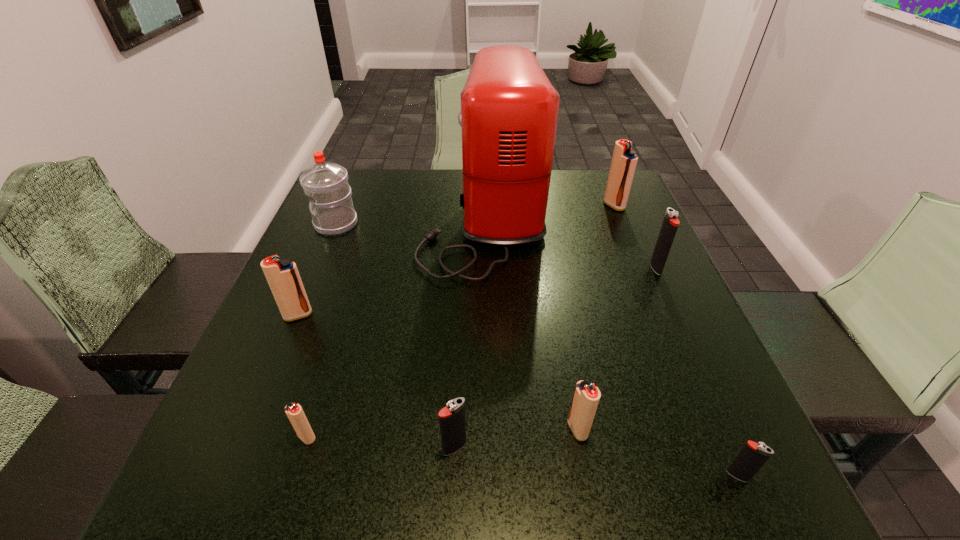
Where is `the second farthest black igniter`? This screenshot has width=960, height=540. the second farthest black igniter is located at coordinates (452, 421).

The height and width of the screenshot is (540, 960). Find the location of `the fourth igniter from right to left`. the fourth igniter from right to left is located at coordinates point(586,397).

Image resolution: width=960 pixels, height=540 pixels. In order to click on the third biggest red igniter in this screenshot , I will do `click(586, 397)`.

In order to click on the seventh object from right to left in this screenshot , I will do [294, 412].

Where is `the second igniter from left to right`? the second igniter from left to right is located at coordinates (294, 412).

At what (x,y) coordinates should I click in order to perform the action: click on the nearest igniter. Please return your answer as a coordinate pair (x, y). The height and width of the screenshot is (540, 960). Looking at the image, I should click on (752, 457).

Locate an element on the screen. the smallest black igniter is located at coordinates (752, 457).

Locate an element on the screen. The image size is (960, 540). vacant space located on the front-facing side of the red kitchen mixer is located at coordinates (397, 220).

This screenshot has width=960, height=540. Find the location of `vacant space situated 0.100m on the front-facing side of the red kitchen mixer`. vacant space situated 0.100m on the front-facing side of the red kitchen mixer is located at coordinates (382, 220).

Where is `free point located on the front-facing side of the red kitchen mixer`? The width and height of the screenshot is (960, 540). free point located on the front-facing side of the red kitchen mixer is located at coordinates (367, 220).